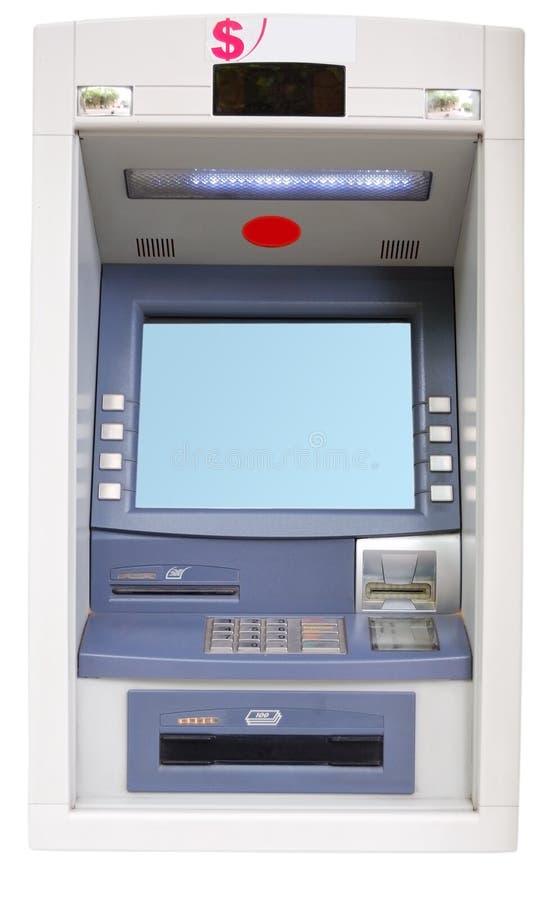
This screenshot has width=549, height=900. I want to click on security camera screen, so click(285, 88).